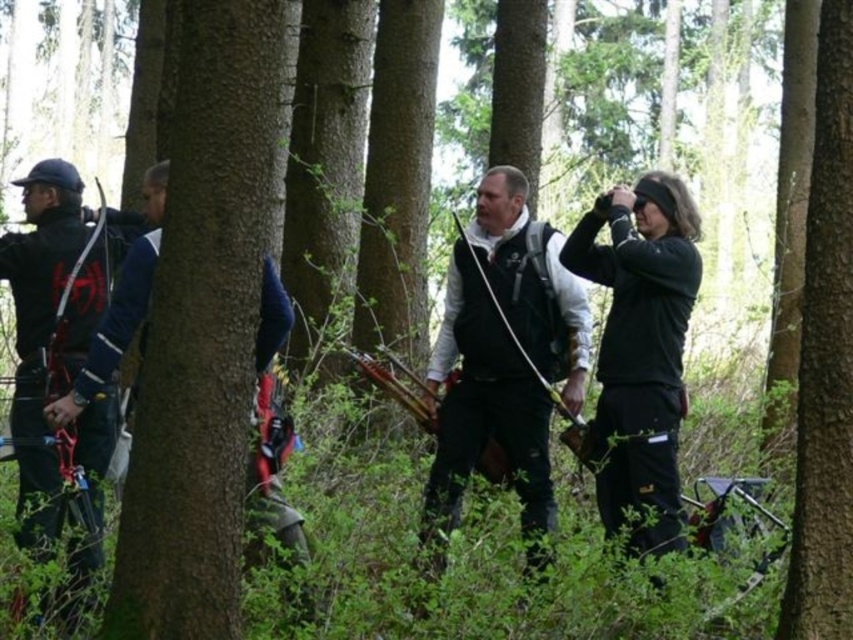
Question: Does black matte jacket at right have a lesser width compared to dark blue jacket at left?

Choices:
 (A) no
 (B) yes

Answer: (A)

Question: Based on their relative distances, which object is farther from the dark blue jacket at left?

Choices:
 (A) matte black jacket at left
 (B) black matte jacket at right
 (C) smooth bark tree at center

Answer: (C)

Question: Observing the image, what is the correct spatial positioning of smooth bark tree at center in reference to matte black jacket at left?

Choices:
 (A) right
 (B) left

Answer: (A)

Question: Which object is the farthest from the black matte vest at center?

Choices:
 (A) dark blue jacket at left
 (B) black matte jacket at right

Answer: (A)

Question: Which of the following is the closest to the observer?

Choices:
 (A) black matte vest at center
 (B) smooth bark tree at center

Answer: (B)

Question: Can you confirm if smooth bark tree at center is positioned to the right of dark blue jacket at left?

Choices:
 (A) no
 (B) yes

Answer: (B)